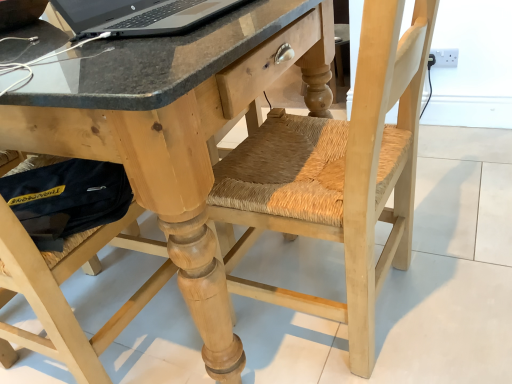
Question: From a real-world perspective, relative to silver metallic laptop at upper left, is natural wood swivel chair at center vertically above or below?

Choices:
 (A) below
 (B) above

Answer: (A)

Question: From the image's perspective, is natural wood swivel chair at center above or below silver metallic laptop at upper left?

Choices:
 (A) below
 (B) above

Answer: (A)

Question: Estimate the real-world distances between objects in this image. Which object is farther from the natural wood swivel chair at center?

Choices:
 (A) natural wood desk at center
 (B) silver metallic laptop at upper left

Answer: (B)

Question: Based on their relative distances, which object is nearer to the silver metallic laptop at upper left?

Choices:
 (A) natural wood desk at center
 (B) natural wood swivel chair at center

Answer: (A)